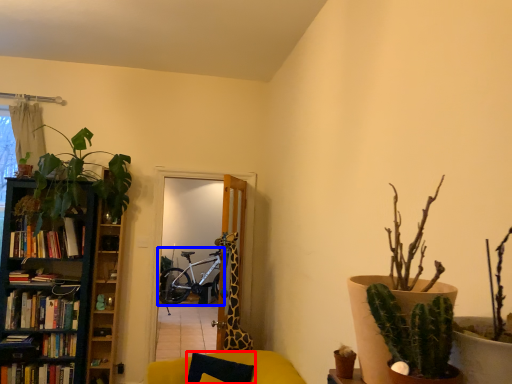
Question: Which object is further to the camera taking this photo, pillow (highlighted by a red box) or bicycle (highlighted by a blue box)?

Choices:
 (A) pillow
 (B) bicycle

Answer: (B)